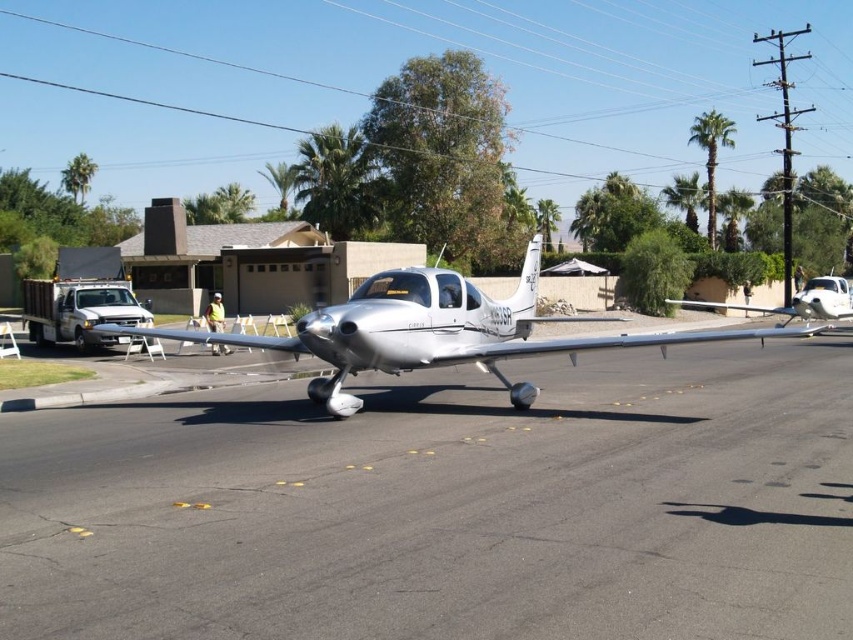
You are a pilot planning to taxi the silver metallic airplane at center from its current position on the smooth asphalt tarmac at center. Considering the tarmac width, will the airplane fit comfortably while moving forward?

The smooth asphalt tarmac at center has a lesser width compared to the silver metallic airplane at center, so the airplane may not fit comfortably due to the narrower tarmac width.

You are standing at the point with coordinates (436, 330) in the image. What object are you directly facing?

You are directly facing the silver metallic airplane at center located at point (436, 330).

You are a pilot standing at the point with coordinates point [447,506]. You need to taxi the small single engine aircraft to the north. Is the surface under your feet suitable for taxiing?

The point [447,506] indicates smooth asphalt tarmac at center, which is suitable for taxiing the small single engine aircraft to the north.